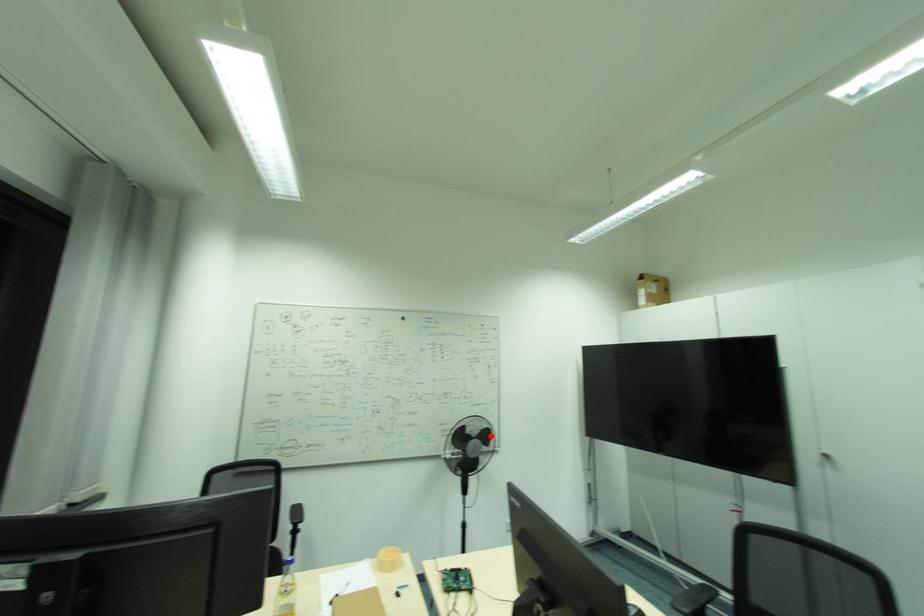
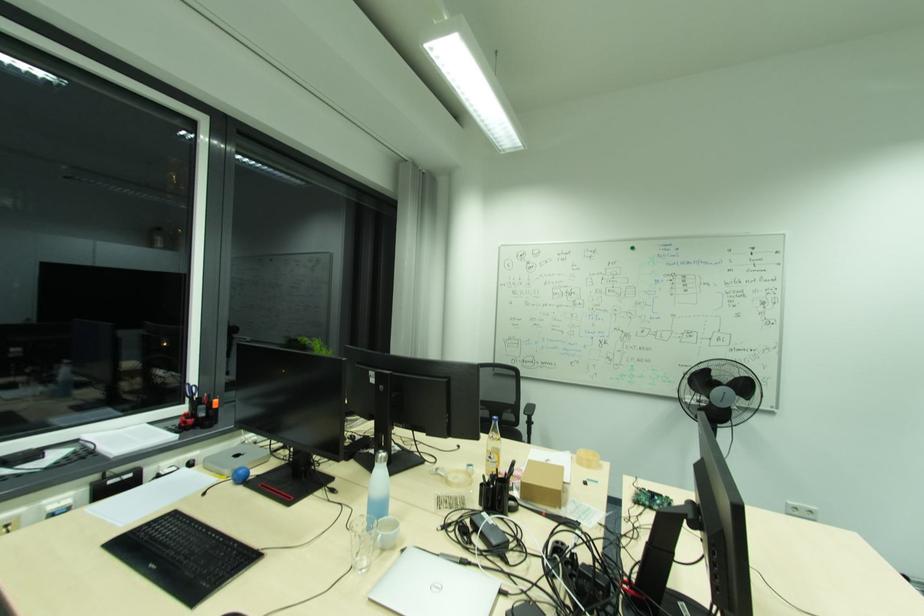
The point at the highlighted location is marked in the first image. Where is the corresponding point in the second image?

(748, 387)